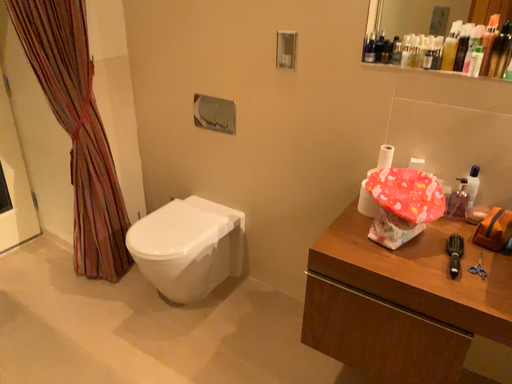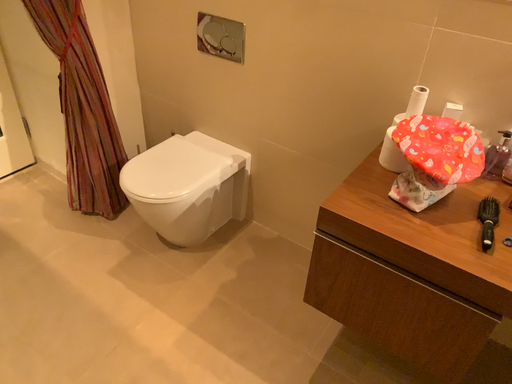
Question: Which way did the camera rotate in the video?

Choices:
 (A) rotated upward
 (B) rotated downward

Answer: (B)